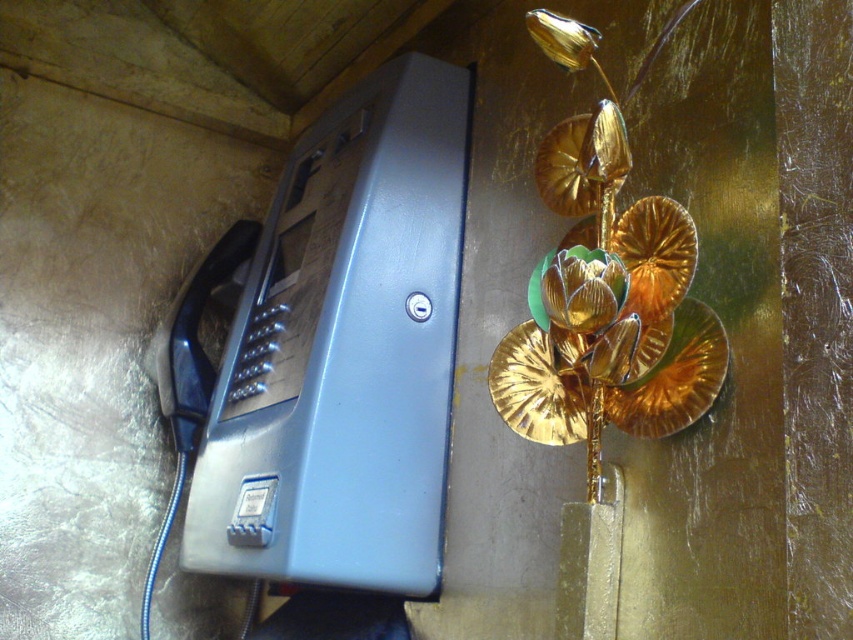
Can you confirm if matte plastic phone box at left is wider than gold metallic flower at center?

Yes.

Is point (454, 324) less distant than point (595, 330)?

That is False.

Locate an element on the screen. The width and height of the screenshot is (853, 640). matte plastic phone box at left is located at coordinates (344, 352).